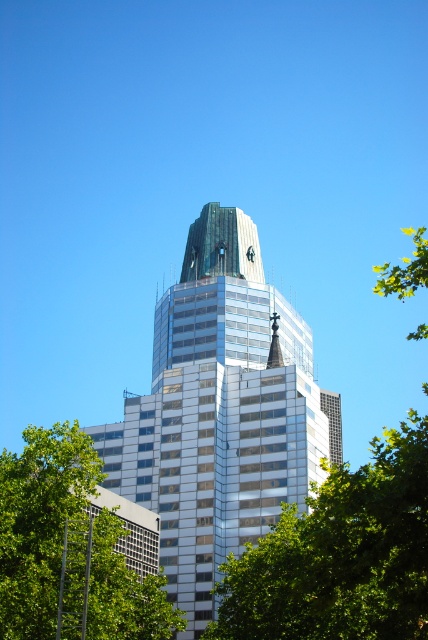
How distant is metallic glass tower at center from green leafy tree at lower left?

metallic glass tower at center and green leafy tree at lower left are 19.48 meters apart from each other.

Is metallic glass tower at center shorter than green leafy tree at lower left?

No, metallic glass tower at center is not shorter than green leafy tree at lower left.

Is point (178, 310) farther from viewer compared to point (48, 483)?

Yes, point (178, 310) is behind point (48, 483).

The height and width of the screenshot is (640, 428). In order to click on metallic glass tower at center in this screenshot , I will do `click(219, 412)`.

Describe the element at coordinates (341, 556) in the screenshot. I see `green leafy tree at center` at that location.

Is point (273, 541) positioned behind point (71, 467)?

Yes, point (273, 541) is behind point (71, 467).

The width and height of the screenshot is (428, 640). Identify the location of green leafy tree at center. (341, 556).

Can you confirm if metallic glass tower at center is thinner than green leafy tree at center?

Indeed, metallic glass tower at center has a lesser width compared to green leafy tree at center.

The height and width of the screenshot is (640, 428). Describe the element at coordinates (219, 412) in the screenshot. I see `metallic glass tower at center` at that location.

Measure the distance between point [336,413] and camera.

Point [336,413] and camera are 343.75 feet apart.

Where is `metallic glass tower at center`? This screenshot has height=640, width=428. metallic glass tower at center is located at coordinates (219, 412).